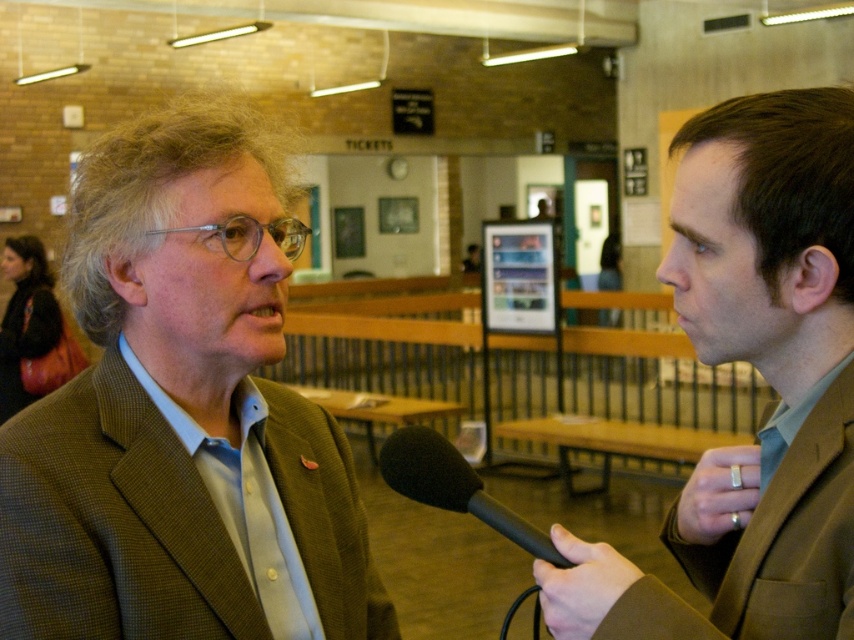
Is point (814, 616) in front of point (502, 520)?

Yes, point (814, 616) is closer to viewer.

Does brown wool suit at right appear over black matte microphone at center?

Yes.

Image resolution: width=854 pixels, height=640 pixels. I want to click on brown wool suit at right, so click(767, 548).

Which is more to the right, brown suit at right or brown wool suit at right?

Positioned to the right is brown wool suit at right.

Does brown suit at right have a lesser width compared to brown wool suit at right?

Incorrect, brown suit at right's width is not less than brown wool suit at right's.

The image size is (854, 640). I want to click on brown suit at right, so click(x=761, y=374).

Is green textured blazer at center below brown wool suit at right?

No.

The width and height of the screenshot is (854, 640). I want to click on green textured blazer at center, so click(x=182, y=416).